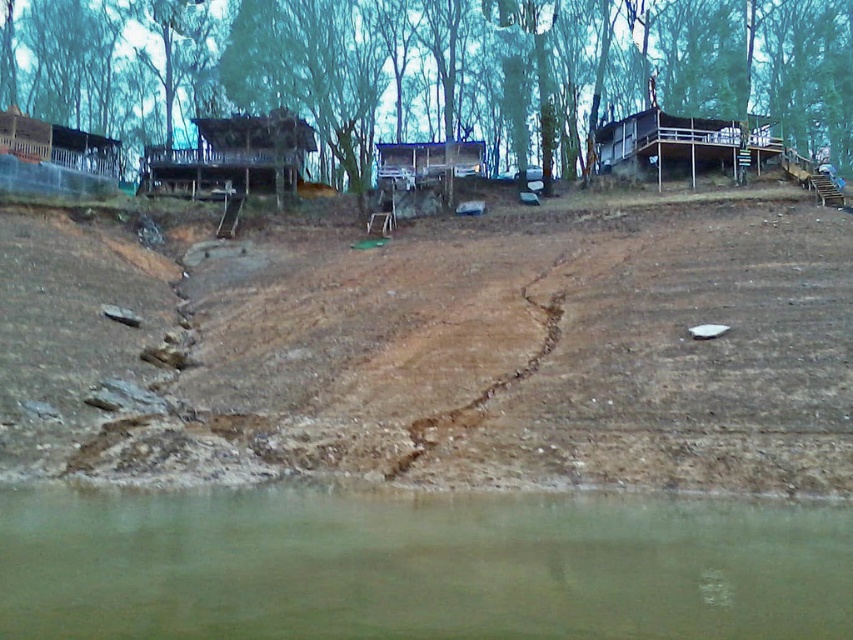
Where is `brown sandy dirt field at lower left`? The image size is (853, 640). brown sandy dirt field at lower left is located at coordinates (538, 355).

Is point (341, 435) positioned in front of point (80, 136)?

Yes, it is.

Where is `brown sandy dirt field at lower left`? The width and height of the screenshot is (853, 640). brown sandy dirt field at lower left is located at coordinates (538, 355).

Does brown sandy dirt field at lower left have a lesser height compared to wooden cabin at upper right?

No, brown sandy dirt field at lower left is not shorter than wooden cabin at upper right.

Between point (276, 403) and point (645, 134), which one is positioned behind?

Positioned behind is point (645, 134).

Image resolution: width=853 pixels, height=640 pixels. What are the coordinates of `brown sandy dirt field at lower left` in the screenshot? It's located at (538, 355).

At what (x,y) coordinates should I click in order to perform the action: click on brown sandy dirt field at lower left. Please return your answer as a coordinate pair (x, y). Looking at the image, I should click on (538, 355).

Which is below, wooden cabin at left or wooden cabin at center?

wooden cabin at center

Who is more distant from viewer, (x=51, y=164) or (x=474, y=161)?

Point (x=474, y=161)

Is point (16, 189) behind point (390, 163)?

No, (16, 189) is in front of (390, 163).

Locate an element on the screen. Image resolution: width=853 pixels, height=640 pixels. wooden cabin at left is located at coordinates (54, 157).